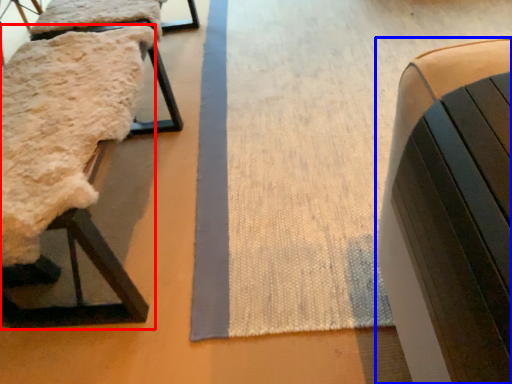
Question: Among these objects, which one is nearest to the camera, furniture (highlighted by a red box) or furniture (highlighted by a blue box)?

Choices:
 (A) furniture
 (B) furniture

Answer: (B)